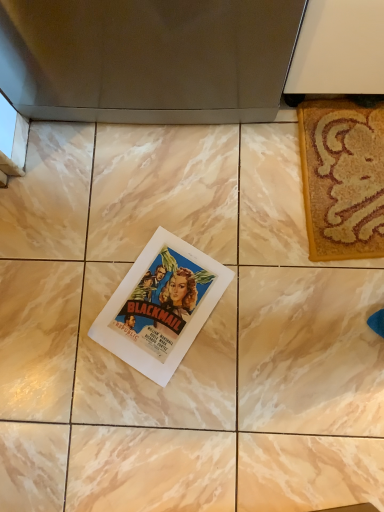
The width and height of the screenshot is (384, 512). What are the coordinates of `vacant area on the back side of white paper at center` in the screenshot? It's located at (144, 207).